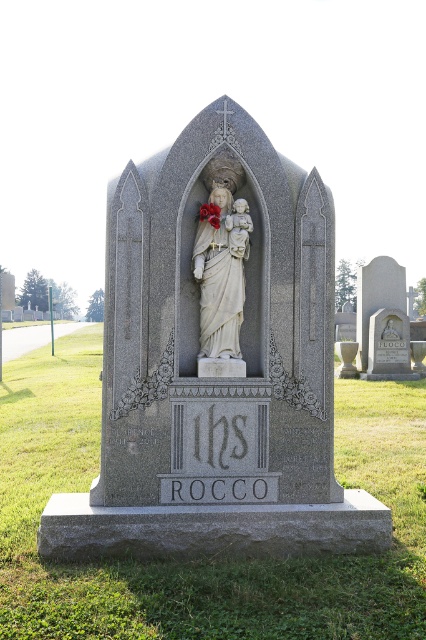
Between gray stone statue at center and white marble statue at center, which one has more height?

gray stone statue at center is taller.

Between gray stone statue at center and white marble statue at center, which one is positioned higher?

white marble statue at center is higher up.

Does point (172, 449) come closer to viewer compared to point (232, 224)?

That is True.

Locate an element on the screen. This screenshot has height=640, width=426. gray stone statue at center is located at coordinates (218, 324).